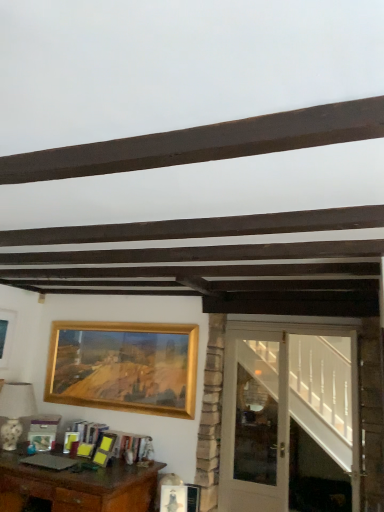
Question: From a real-world perspective, is brown wooden desk at lower left below white glossy door at right?

Choices:
 (A) no
 (B) yes

Answer: (B)

Question: Can you confirm if brown wooden desk at lower left is thinner than white glossy door at right?

Choices:
 (A) yes
 (B) no

Answer: (B)

Question: Can you confirm if brown wooden desk at lower left is wider than white glossy door at right?

Choices:
 (A) no
 (B) yes

Answer: (B)

Question: From the image's perspective, does brown wooden desk at lower left appear lower than white glossy door at right?

Choices:
 (A) no
 (B) yes

Answer: (B)

Question: Would you say brown wooden desk at lower left is outside white glossy door at right?

Choices:
 (A) yes
 (B) no

Answer: (A)

Question: Is brown wooden desk at lower left at the left side of white glossy door at right?

Choices:
 (A) yes
 (B) no

Answer: (A)

Question: Is gold metallic picture frame at upper left, which ranks as the first picture frame in left-to-right order, positioned behind white glossy lampshade at left?

Choices:
 (A) yes
 (B) no

Answer: (A)

Question: Does gold metallic picture frame at upper left, which ranks as the first picture frame in left-to-right order, have a larger size compared to white glossy lampshade at left?

Choices:
 (A) yes
 (B) no

Answer: (B)

Question: Considering the relative sizes of gold metallic picture frame at upper left, the second picture frame in the right-to-left sequence, and white glossy lampshade at left in the image provided, is gold metallic picture frame at upper left, the second picture frame in the right-to-left sequence, wider than white glossy lampshade at left?

Choices:
 (A) yes
 (B) no

Answer: (B)

Question: From the image's perspective, does gold metallic picture frame at upper left, the second picture frame in the right-to-left sequence, appear higher than white glossy lampshade at left?

Choices:
 (A) yes
 (B) no

Answer: (A)

Question: Is gold metallic picture frame at upper left, which ranks as the first picture frame in left-to-right order, positioned with its back to white glossy lampshade at left?

Choices:
 (A) no
 (B) yes

Answer: (A)

Question: Is the position of gold metallic picture frame at upper left, the second picture frame in the right-to-left sequence, less distant than that of white glossy lampshade at left?

Choices:
 (A) no
 (B) yes

Answer: (A)

Question: Can you confirm if white glass door at right is wider than gold metallic picture frame at upper center, arranged as the 2th picture frame when viewed from the left?

Choices:
 (A) no
 (B) yes

Answer: (B)